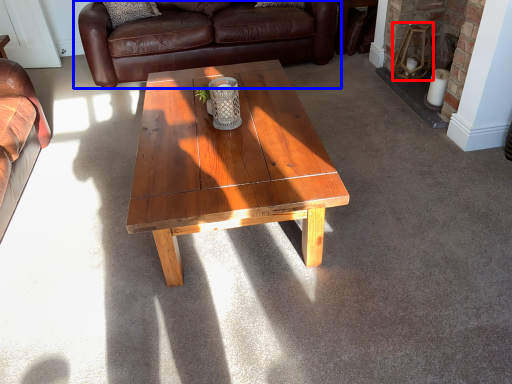
Question: Which object is closer to the camera taking this photo, stool (highlighted by a red box) or studio couch (highlighted by a blue box)?

Choices:
 (A) stool
 (B) studio couch

Answer: (A)